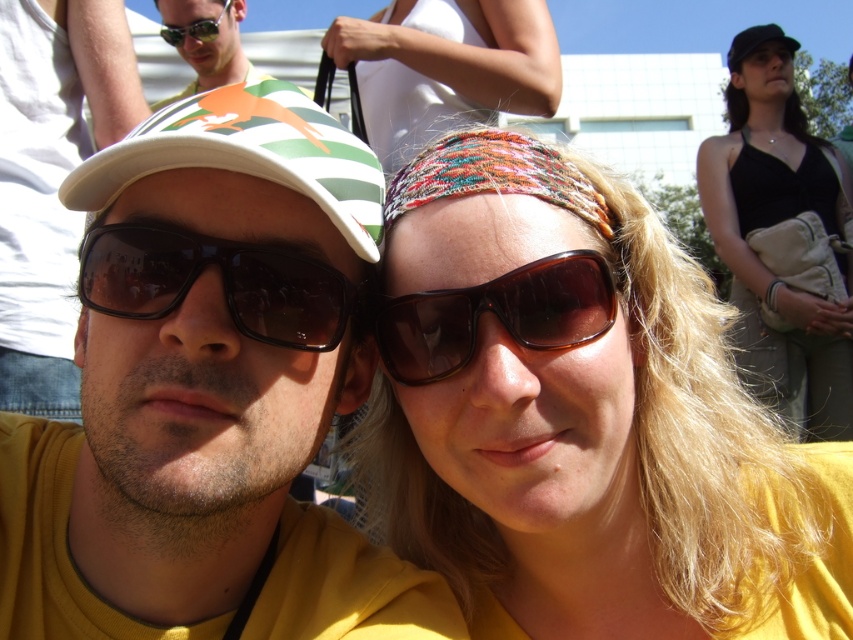
You are taking a photo and want to focus on the multicolored woven headband at center and the woven fabric headband at upper center. Which headband is closer to the camera?

The multicolored woven headband at center is closer to the viewer than the woven fabric headband at upper center, so it is closer to the camera.

You are a photographer trying to capture a detailed shot of the green and white striped baseball cap at left and the brown textured sunglasses at center. Given that your camera has a depth of field that can sharply focus on objects within a 12 inch range, will both items be in focus simultaneously?

The distance between the green and white striped baseball cap at left and the brown textured sunglasses at center is 13.59 inches, which exceeds the camera lens depth of field range of 12 inches. Therefore, both items cannot be in focus at the same time.